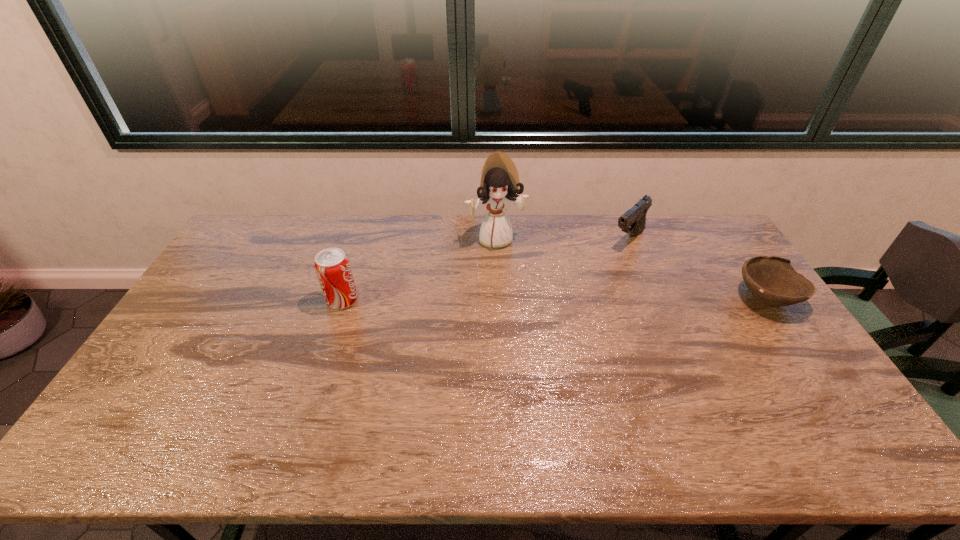
Where is `vacant region located at the barrel of the second object from right to left`? vacant region located at the barrel of the second object from right to left is located at coordinates (570, 295).

Where is `free space located at the barrel of the second object from right to left`? This screenshot has width=960, height=540. free space located at the barrel of the second object from right to left is located at coordinates (604, 263).

Identify the location of vacant space located at the front face of the second object from left to right. (527, 323).

This screenshot has height=540, width=960. In order to click on vacant area situated at the front face of the second object from left to right in this screenshot , I will do `click(531, 333)`.

Identify the location of free space located 0.210m at the front face of the second object from left to right. The height and width of the screenshot is (540, 960). (516, 291).

Find the location of `pistol located at the far edge`. pistol located at the far edge is located at coordinates (633, 221).

Locate an element on the screen. The image size is (960, 540). doll present at the far edge is located at coordinates (499, 183).

Identify the location of object positioned at the right edge. The image size is (960, 540). (772, 280).

Find the location of a particular element. vacant space at the far edge of the desktop is located at coordinates (581, 245).

Where is `vacant region at the near edge of the desktop`? This screenshot has width=960, height=540. vacant region at the near edge of the desktop is located at coordinates (346, 397).